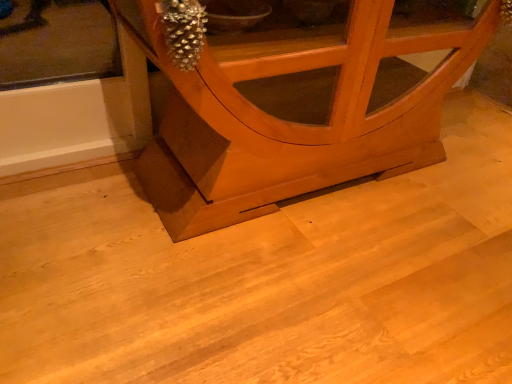
Image resolution: width=512 pixels, height=384 pixels. Identify the location of pine wood cabinet at center. (290, 120).

In order to face pine wood cabinet at center, should I rotate leftwards or rightwards?

Rotate right and turn 6.909 degrees.

The height and width of the screenshot is (384, 512). What do you see at coordinates (290, 120) in the screenshot? I see `pine wood cabinet at center` at bounding box center [290, 120].

Identify the location of pine wood cabinet at center. (290, 120).